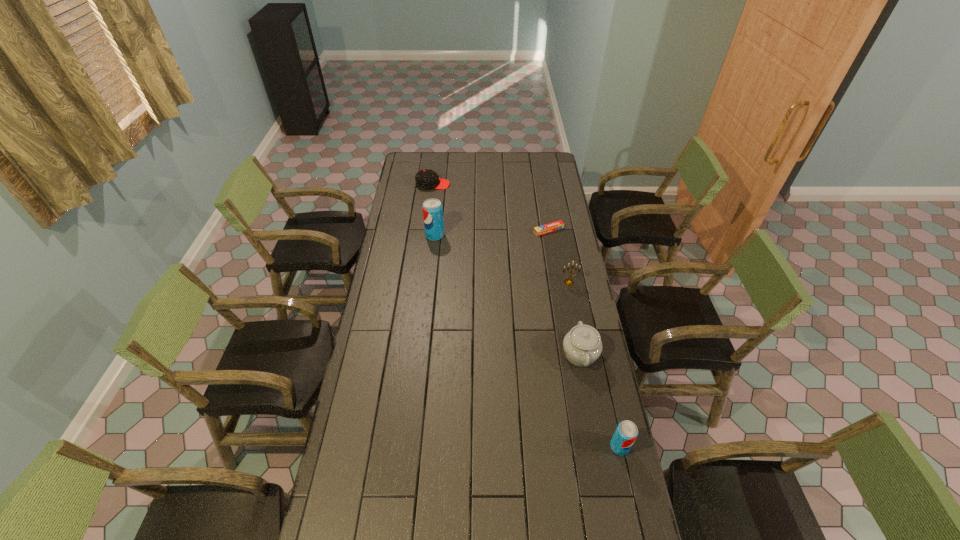
Locate an element on the screen. the farther soda can is located at coordinates (432, 208).

Identify the location of the taller soda can. The height and width of the screenshot is (540, 960). (432, 208).

At what (x,y) coordinates should I click in order to perform the action: click on the nearer soda can. Please return your answer as a coordinate pair (x, y). Looking at the image, I should click on (626, 432).

Find the location of a particular element. Image resolution: width=960 pixels, height=540 pixels. the nearest object is located at coordinates (626, 432).

Find the location of a particular element. This screenshot has width=960, height=540. candelabrum is located at coordinates (569, 282).

This screenshot has height=540, width=960. What are the coordinates of `the fifth tallest object` in the screenshot? It's located at (x=425, y=179).

Where is `the farthest object`? the farthest object is located at coordinates point(425,179).

This screenshot has height=540, width=960. I want to click on toothpaste, so click(x=550, y=227).

Locate an element on the screen. Image resolution: width=960 pixels, height=540 pixels. the fifth farthest object is located at coordinates (582, 345).

You are a GUI agent. You are given a task and a screenshot of the screen. Output one action in this format:
    pyautogui.click(x=<x>, y=<y>)
    Task: Click on the free spot located 0.230m on the right of the tallest object
    This screenshot has height=540, width=960.
    Given the screenshot: What is the action you would take?
    pyautogui.click(x=491, y=235)